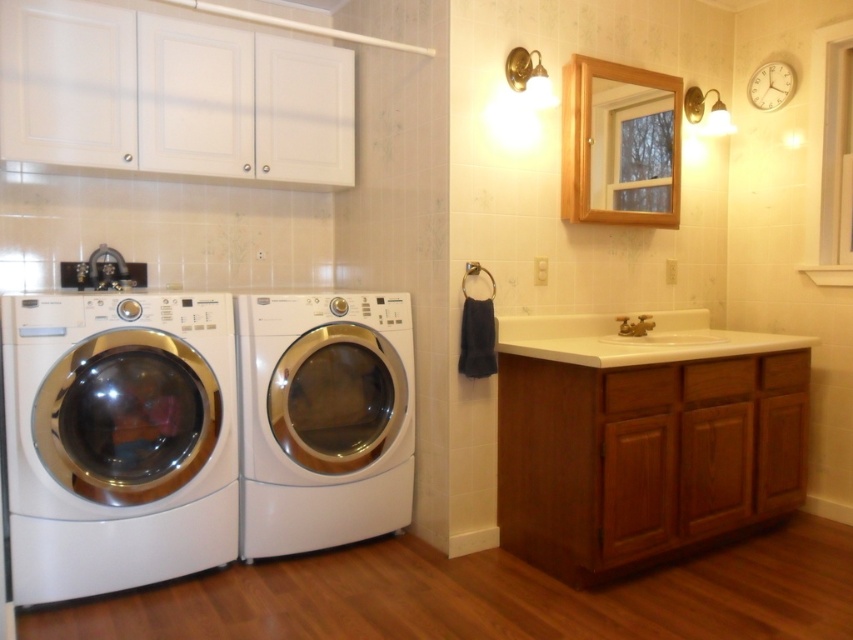
You are moving a large box through the laundry room and need to pass between the white glossy washing machine at center and the white glossy sink at center. Can you fit through the space between them?

The white glossy washing machine at center is positioned on the left side of the white glossy sink at center, so there is space between them. However, the exact width of the space isn not provided, so it is uncertain if the large box will fit through.

You are moving a small laundry basket that is 0.5 meters wide. You want to place it between the white glossy washing machine at lower left and the white glossy sink at center. Is there enough space for the basket?

The white glossy washing machine at lower left is bigger than the white glossy sink at center, so there is sufficient space between them to place the laundry basket that is 0.5 meters wide.